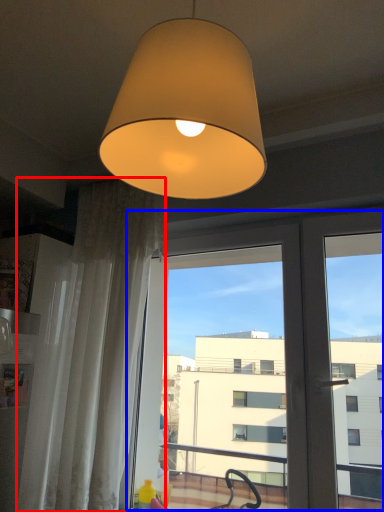
Question: Which object appears closest to the camera in this image, curtain (highlighted by a red box) or screen door (highlighted by a blue box)?

Choices:
 (A) curtain
 (B) screen door

Answer: (B)